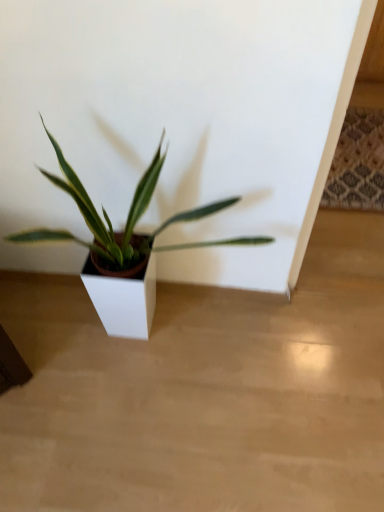
What are the coordinates of `vacant space situated on the left part of green glossy plant at center` in the screenshot? It's located at (48, 356).